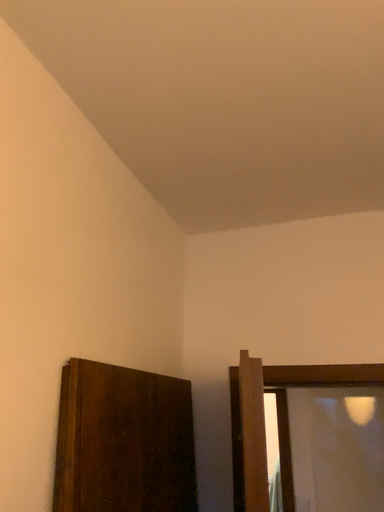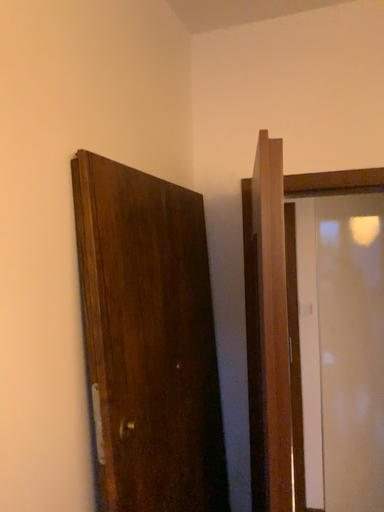
Question: Which way did the camera rotate in the video?

Choices:
 (A) rotated downward
 (B) rotated upward

Answer: (A)